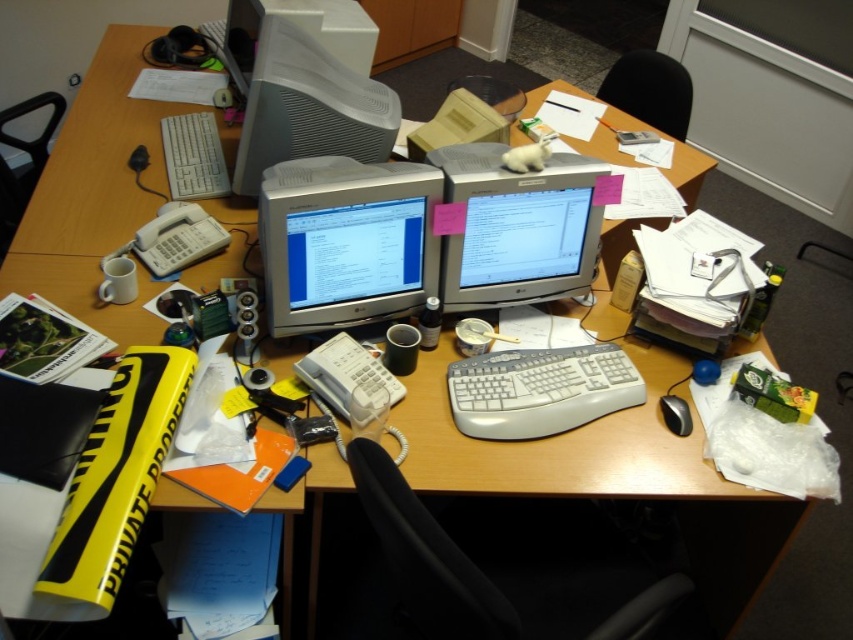
Can you confirm if matte gray monitor at center is smaller than white plastic monitor at upper center?

Yes, matte gray monitor at center is smaller than white plastic monitor at upper center.

Who is more forward, (521,280) or (223,33)?

Point (521,280) is more forward.

Identify the location of matte gray monitor at center. (517, 227).

Is matte silver monitor at center taller than satin silver monitor at center?

No, matte silver monitor at center is not taller than satin silver monitor at center.

Who is higher up, matte silver monitor at center or satin silver monitor at center?

satin silver monitor at center is higher up.

At what (x,y) coordinates should I click in order to perform the action: click on matte silver monitor at center. Please return your answer as a coordinate pair (x, y). Looking at the image, I should click on (346, 241).

At what (x,y) coordinates should I click in order to perform the action: click on matte silver monitor at center. Please return your answer as a coordinate pair (x, y). Looking at the image, I should click on (346, 241).

Is matte silver monitor at center to the left of white plastic keyboard at center from the viewer's perspective?

Correct, you'll find matte silver monitor at center to the left of white plastic keyboard at center.

Which is behind, point (315, 301) or point (482, 394)?

The point (315, 301) is more distant.

Find the location of a particular element. matte silver monitor at center is located at coordinates (346, 241).